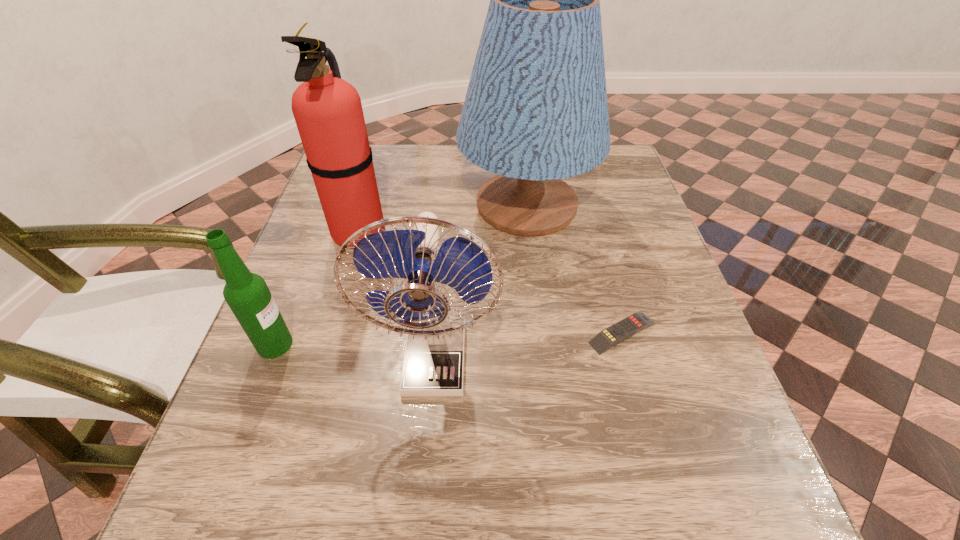
Image resolution: width=960 pixels, height=540 pixels. What are the coordinates of `free region that satisfies the following two spatial constraints: 1. on the front side of the lampshade; 2. on the label of the beer bottle` in the screenshot? It's located at (543, 345).